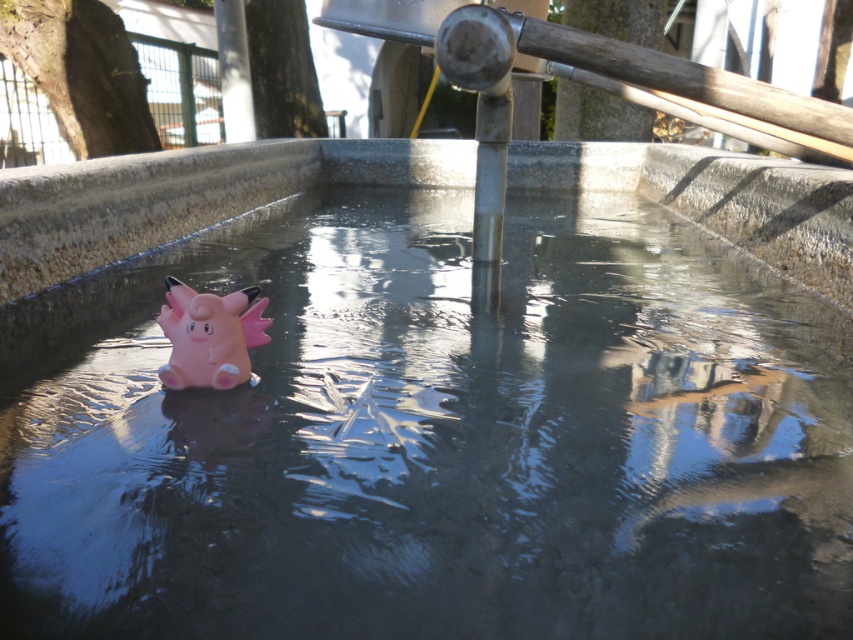
Who is more distant from viewer, (811, 456) or (218, 364)?

Positioned behind is point (218, 364).

Identify the location of transparent water at center. The width and height of the screenshot is (853, 640). (434, 436).

You are a GUI agent. You are given a task and a screenshot of the screen. Output one action in this format:
    pyautogui.click(x=<x>, y=<y>)
    Task: Click on the transparent water at center
    This screenshot has height=640, width=853.
    Given the screenshot: What is the action you would take?
    pyautogui.click(x=434, y=436)